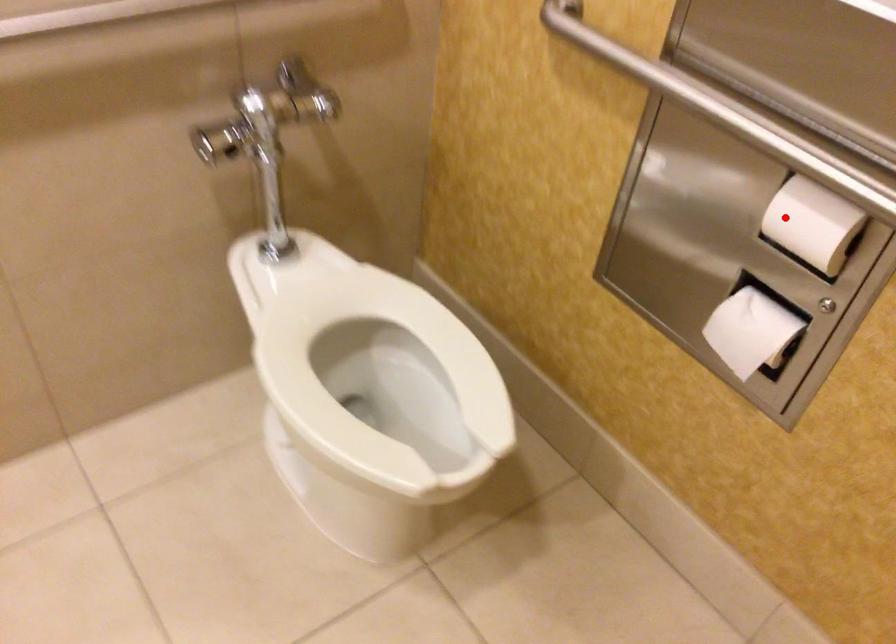
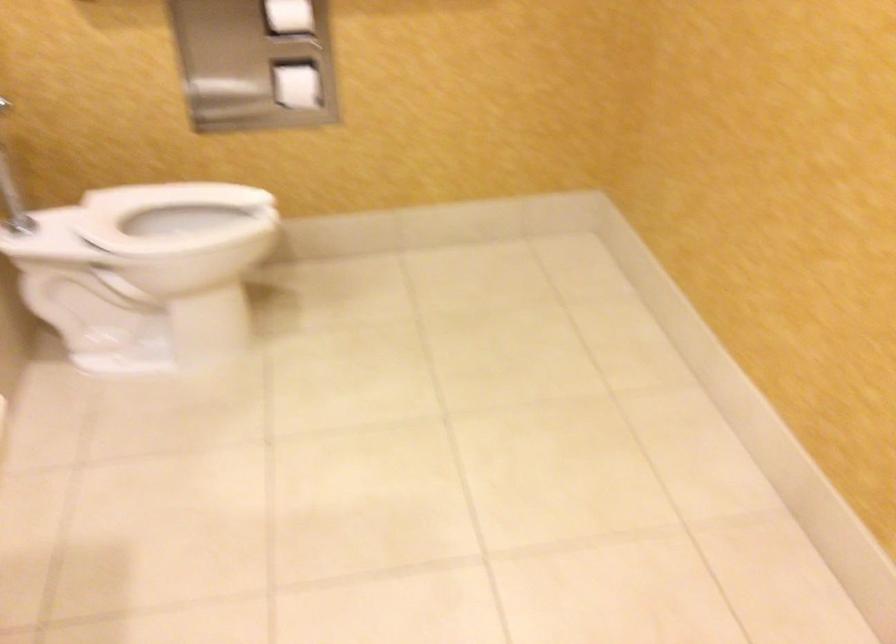
Question: I am providing you with two images of the same scene from different viewpoints. Given a red point in image1, look at the same physical point in image2. Is it:

Choices:
 (A) Closer to the viewpoint
 (B) Farther from the viewpoint

Answer: (B)